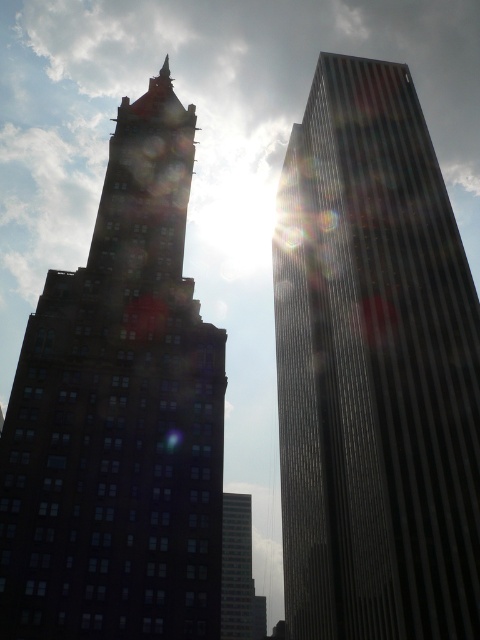
Question: Which object is farther from the camera taking this photo?

Choices:
 (A) matte glass building at left
 (B) smooth glass skyscraper at center
 (C) reflective glass skyscraper at right

Answer: (B)

Question: Which of the following is the closest to the observer?

Choices:
 (A) (85, 384)
 (B) (240, 584)
 (C) (440, 634)

Answer: (C)

Question: Can you confirm if matte glass building at left is thinner than smooth glass skyscraper at center?

Choices:
 (A) yes
 (B) no

Answer: (B)

Question: Can you confirm if reflective glass skyscraper at right is positioned below matte glass building at left?

Choices:
 (A) yes
 (B) no

Answer: (A)

Question: Which point appears farthest from the camera in this image?

Choices:
 (A) (419, 342)
 (B) (91, 248)

Answer: (A)

Question: Can you confirm if reflective glass skyscraper at right is positioned to the right of smooth glass skyscraper at center?

Choices:
 (A) yes
 (B) no

Answer: (A)